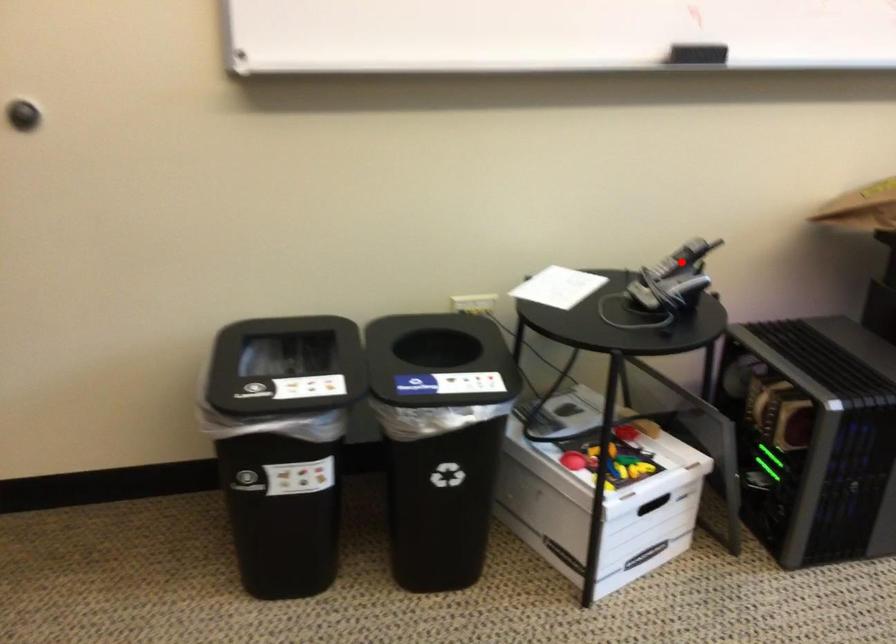
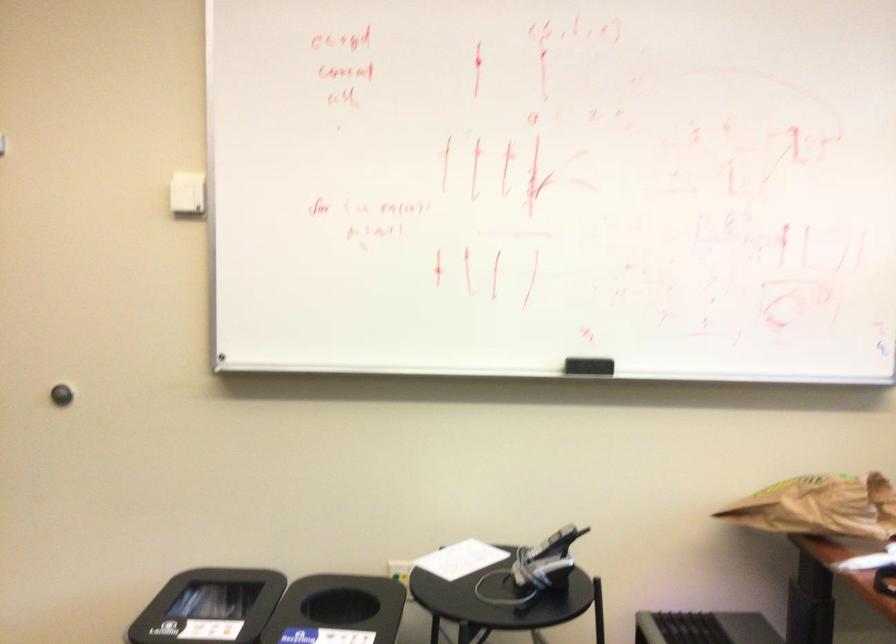
Find the pixel in the second image that matches the highlighted location in the first image.

(552, 544)